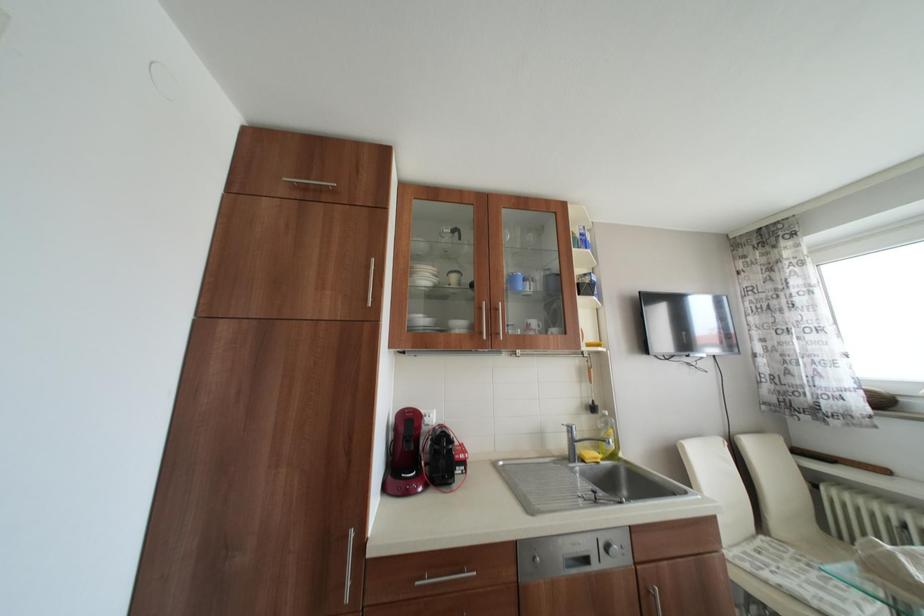
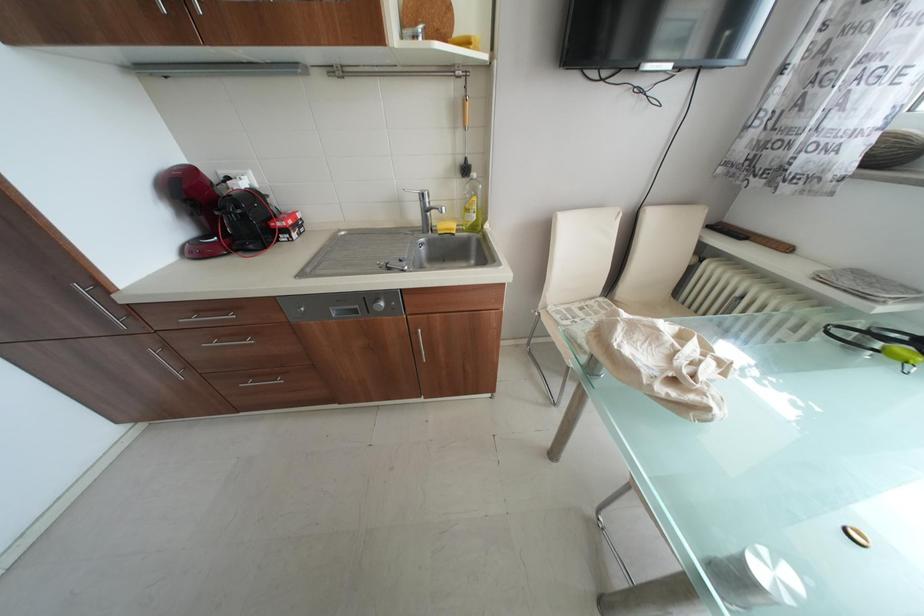
Question: The images are taken continuously from a first-person perspective. In which direction is your viewpoint rotating?

Choices:
 (A) Left
 (B) Right
 (C) Up
 (D) Down

Answer: (D)